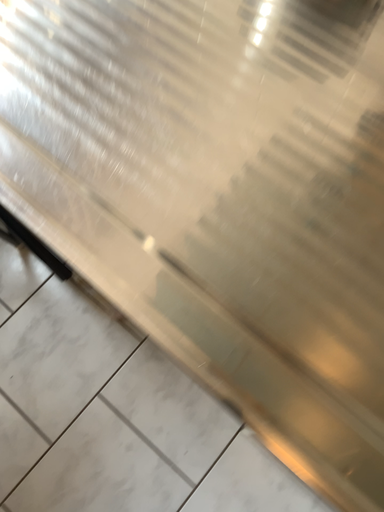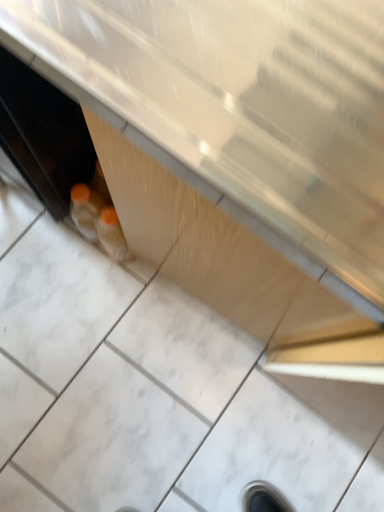
Question: Which way did the camera rotate in the video?

Choices:
 (A) rotated upward
 (B) rotated downward

Answer: (B)